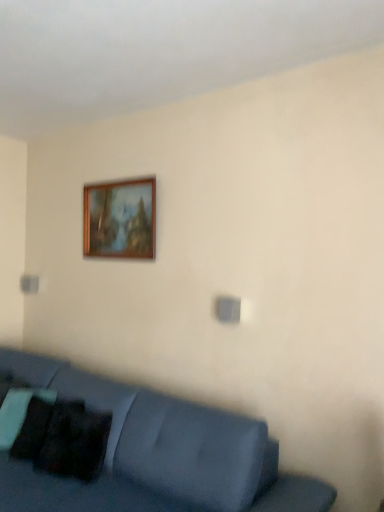
Question: Could you tell me if matte blue couch at lower left is turned towards wooden picture frame at upper center?

Choices:
 (A) no
 (B) yes

Answer: (A)

Question: Is matte blue couch at lower left not inside wooden picture frame at upper center?

Choices:
 (A) no
 (B) yes

Answer: (B)

Question: Considering the relative sizes of matte blue couch at lower left and wooden picture frame at upper center in the image provided, is matte blue couch at lower left smaller than wooden picture frame at upper center?

Choices:
 (A) yes
 (B) no

Answer: (B)

Question: From the image's perspective, is matte blue couch at lower left located above wooden picture frame at upper center?

Choices:
 (A) yes
 (B) no

Answer: (B)

Question: From a real-world perspective, is matte blue couch at lower left positioned under wooden picture frame at upper center based on gravity?

Choices:
 (A) yes
 (B) no

Answer: (A)

Question: From a real-world perspective, relative to matte blue couch at lower left, is black matte pillow at lower left vertically above or below?

Choices:
 (A) below
 (B) above

Answer: (B)

Question: Choose the correct answer: Is black matte pillow at lower left inside matte blue couch at lower left or outside it?

Choices:
 (A) inside
 (B) outside

Answer: (A)

Question: Is black matte pillow at lower left in front of or behind matte blue couch at lower left in the image?

Choices:
 (A) front
 (B) behind

Answer: (B)

Question: Is point (100, 414) positioned closer to the camera than point (185, 435)?

Choices:
 (A) farther
 (B) closer

Answer: (A)

Question: Relative to matte blue couch at lower left, is wooden picture frame at upper center in front or behind?

Choices:
 (A) behind
 (B) front

Answer: (A)

Question: From a real-world perspective, is wooden picture frame at upper center physically located above or below matte blue couch at lower left?

Choices:
 (A) above
 (B) below

Answer: (A)

Question: From the image's perspective, is wooden picture frame at upper center located above or below matte blue couch at lower left?

Choices:
 (A) above
 (B) below

Answer: (A)

Question: Is wooden picture frame at upper center wider or thinner than matte blue couch at lower left?

Choices:
 (A) wide
 (B) thin

Answer: (B)

Question: In terms of width, does wooden picture frame at upper center look wider or thinner when compared to black matte pillow at lower left?

Choices:
 (A) wide
 (B) thin

Answer: (B)

Question: Is wooden picture frame at upper center situated inside black matte pillow at lower left or outside?

Choices:
 (A) outside
 (B) inside

Answer: (A)